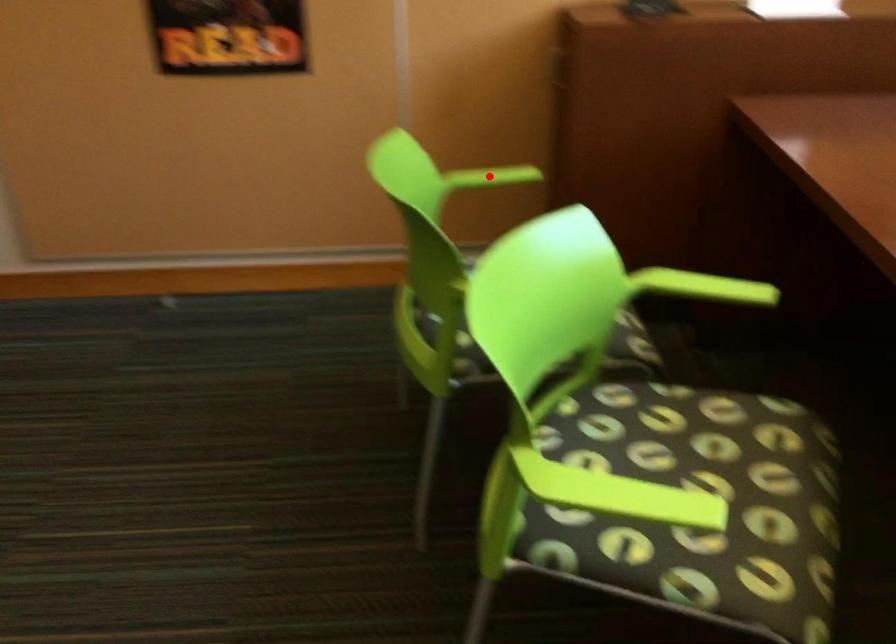
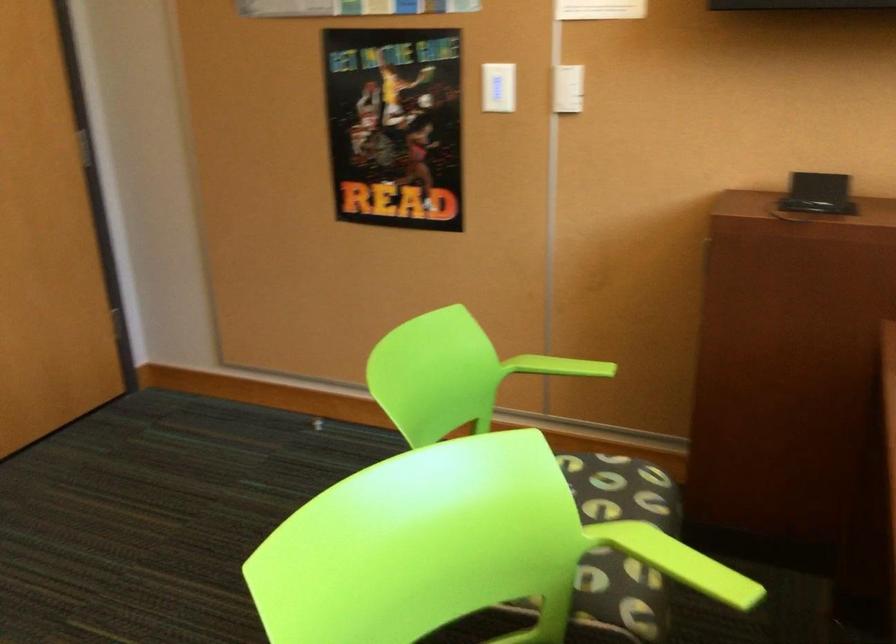
Question: I am providing you with two images of the same scene from different viewpoints. In image1, a red point is highlighted. Considering the same 3D point in image2, which of the following is correct?

Choices:
 (A) It is closer
 (B) It is farther

Answer: (A)